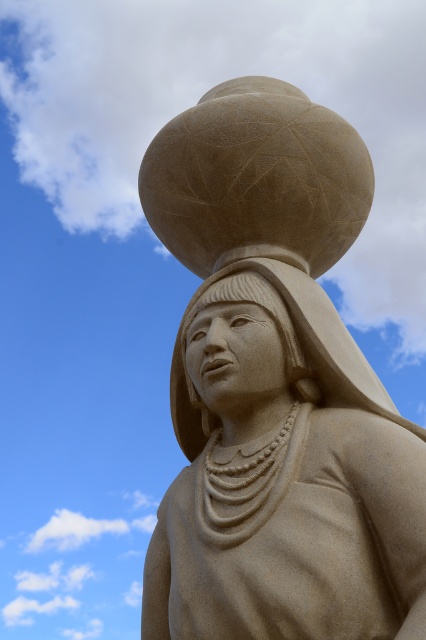
Question: Which object appears closest to the camera in this image?

Choices:
 (A) beige stone sphere at upper center
 (B) sandy beige statue at center

Answer: (A)

Question: Is beige stone sphere at upper center below sandy beige statue at center?

Choices:
 (A) yes
 (B) no

Answer: (B)

Question: Does beige stone sphere at upper center appear under sandy beige statue at center?

Choices:
 (A) no
 (B) yes

Answer: (A)

Question: Is beige stone sphere at upper center to the left of sandy beige statue at center from the viewer's perspective?

Choices:
 (A) yes
 (B) no

Answer: (B)